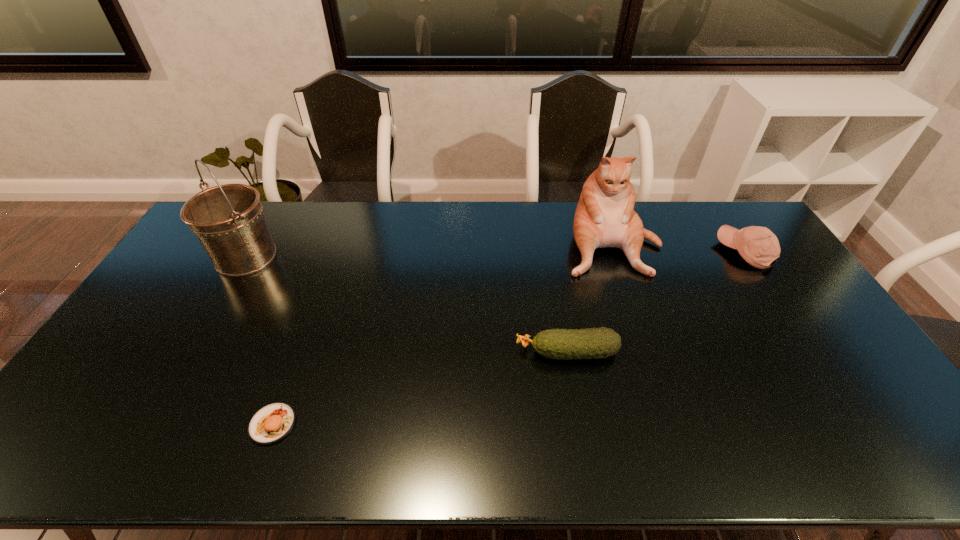
You are a GUI agent. You are given a task and a screenshot of the screen. Output one action in this format:
    pyautogui.click(x=<x>, y=<y>)
    Task: Click on the free space between the baseball cap and the cat
    This screenshot has width=960, height=540.
    Given the screenshot: What is the action you would take?
    pyautogui.click(x=679, y=248)

Where is `free spot between the cat and the fourth object from right to left`? The height and width of the screenshot is (540, 960). free spot between the cat and the fourth object from right to left is located at coordinates (443, 334).

At what (x,y) coordinates should I click in order to perform the action: click on vacant area that lies between the shortest object and the second nearest object. Please return your answer as a coordinate pair (x, y). The height and width of the screenshot is (540, 960). Looking at the image, I should click on (420, 388).

At what (x,y) coordinates should I click in order to perform the action: click on free point between the patty and the fourth tallest object. Please return your answer as a coordinate pair (x, y). This screenshot has width=960, height=540. Looking at the image, I should click on (420, 388).

Image resolution: width=960 pixels, height=540 pixels. What are the coordinates of `unoccupied position between the rightmost object and the cat` in the screenshot? It's located at (679, 248).

The width and height of the screenshot is (960, 540). What are the coordinates of `free space between the third tallest object and the leftmost object` in the screenshot? It's located at (495, 254).

At what (x,y) coordinates should I click in order to perform the action: click on free space between the bucket and the second shortest object. Please return your answer as a coordinate pair (x, y). Looking at the image, I should click on (407, 305).

The image size is (960, 540). I want to click on free space that is in between the second object from left to right and the second shortest object, so click(420, 388).

The height and width of the screenshot is (540, 960). In order to click on vacant space in between the fourth farthest object and the cat in this screenshot , I will do `click(589, 299)`.

Find the location of a particular element. Image resolution: width=960 pixels, height=540 pixels. the third closest object to the second object from left to right is located at coordinates (604, 217).